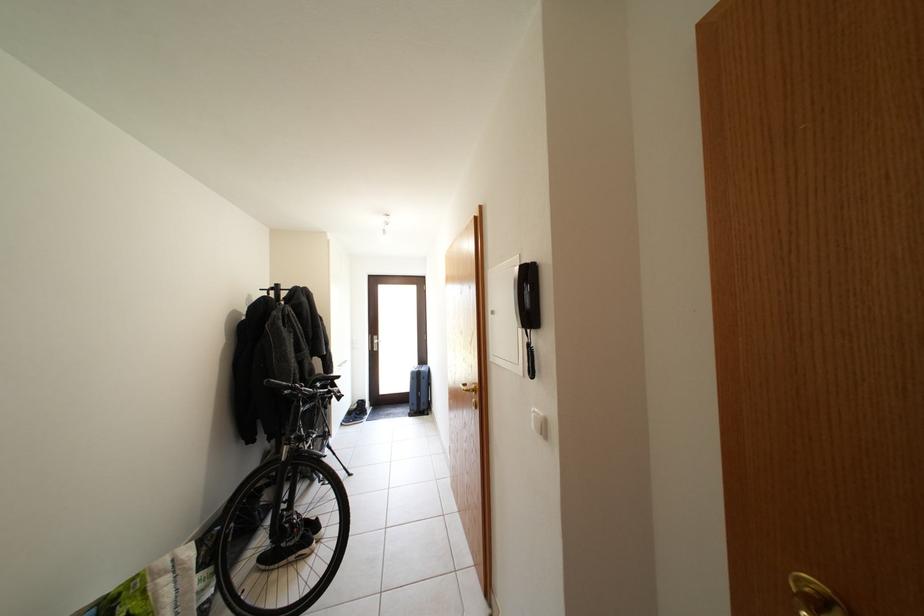
Image resolution: width=924 pixels, height=616 pixels. In order to click on bicycle handlebar grip in this screenshot , I will do `click(274, 384)`.